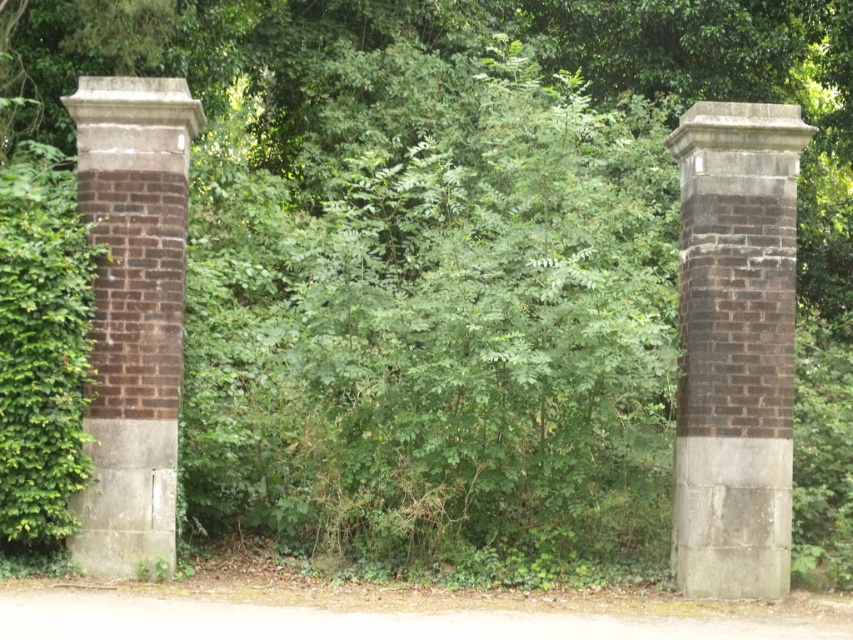
From the picture: Can you confirm if brown brick column at right is bigger than brown brick pillar at left?

Correct, brown brick column at right is larger in size than brown brick pillar at left.

Who is more distant from viewer, (741, 420) or (93, 170)?

The point (741, 420) is behind.

Between point (717, 577) and point (144, 177), which one is positioned in front?

Point (144, 177)

Identify the location of brown brick column at right. The image size is (853, 640). [x=735, y=348].